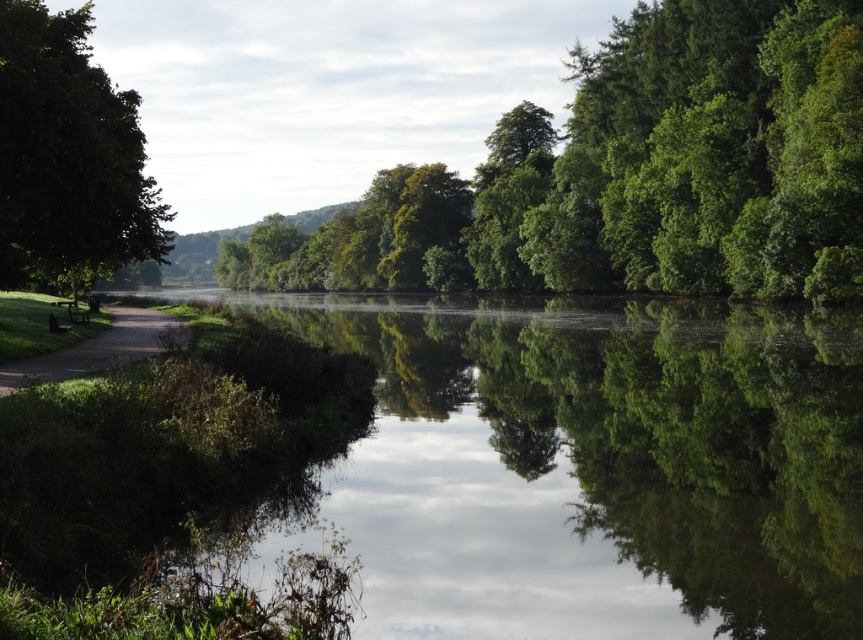
Question: Considering the real-world distances, which object is farthest from the green reflective water at center?

Choices:
 (A) green grassy path at left
 (B) wooden park bench at left
 (C) green leafy tree at center
 (D) green leafy tree at left

Answer: (C)

Question: Is green reflective water at center to the left of green grassy path at left from the viewer's perspective?

Choices:
 (A) no
 (B) yes

Answer: (A)

Question: Based on their relative distances, which object is farther from the wooden park bench at left?

Choices:
 (A) green reflective water at center
 (B) green leafy tree at left

Answer: (A)

Question: Which point is farther to the camera?

Choices:
 (A) (17, 257)
 (B) (117, 316)
 (C) (786, 339)

Answer: (B)

Question: Is green leafy tree at left in front of wooden park bench at left?

Choices:
 (A) no
 (B) yes

Answer: (B)

Question: Does green leafy tree at left have a larger size compared to wooden park bench at left?

Choices:
 (A) no
 (B) yes

Answer: (B)